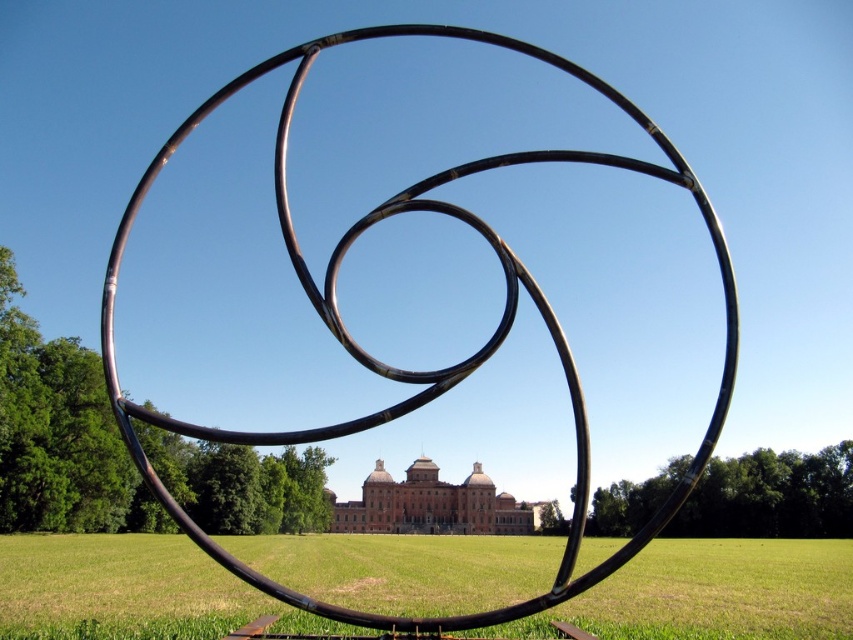
Question: In this image, where is green grass at center located relative to polished metal rings at center?

Choices:
 (A) above
 (B) below

Answer: (B)

Question: Which of the following is the farthest from the observer?

Choices:
 (A) green grass at center
 (B) polished metal rings at center

Answer: (A)

Question: Which of the following is the farthest from the observer?

Choices:
 (A) (212, 104)
 (B) (136, 536)

Answer: (B)

Question: Which point is closer to the camera?

Choices:
 (A) polished metal rings at center
 (B) green grass at center

Answer: (A)

Question: From the image, what is the correct spatial relationship of green grass at center in relation to polished metal rings at center?

Choices:
 (A) above
 (B) below

Answer: (B)

Question: Is green grass at center above polished metal rings at center?

Choices:
 (A) no
 (B) yes

Answer: (A)